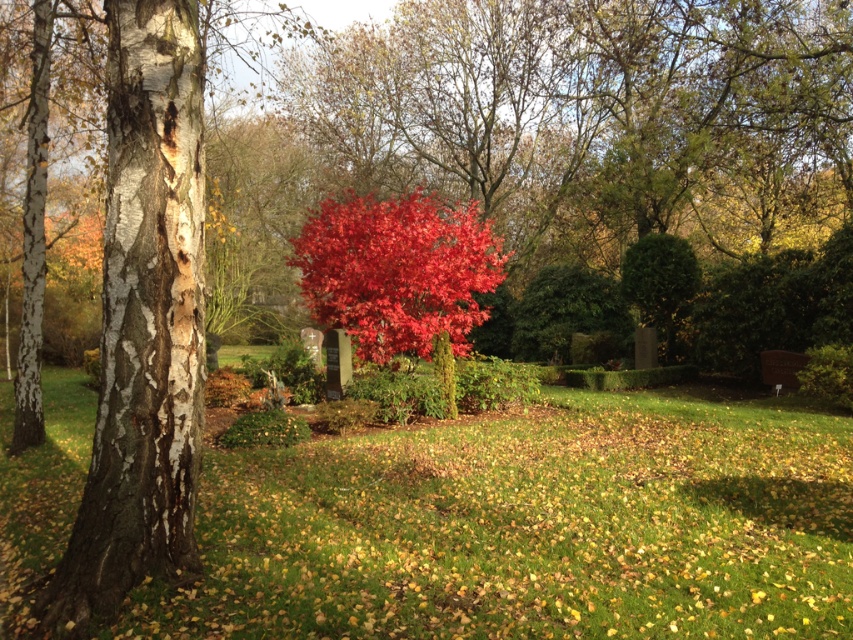
Between point (196, 468) and point (471, 296), which one is positioned in front?

Point (196, 468)

Between white bark birch tree at left and shiny red maple at center, which one appears on the right side from the viewer's perspective?

Positioned to the right is shiny red maple at center.

Is point (164, 273) farther from viewer compared to point (415, 214)?

No, it is not.

This screenshot has width=853, height=640. What are the coordinates of `white bark birch tree at left` in the screenshot? It's located at pyautogui.click(x=143, y=321).

Between point (44, 534) and point (108, 49), which one is positioned behind?

Positioned behind is point (44, 534).

Locate an element on the screen. Image resolution: width=853 pixels, height=640 pixels. green grass at center is located at coordinates (527, 528).

This screenshot has height=640, width=853. Find the location of `green grass at center`. green grass at center is located at coordinates (527, 528).

Based on the photo, can you confirm if green grass at center is smaller than shiny red maple at center?

Yes, green grass at center is smaller than shiny red maple at center.

Between green grass at center and shiny red maple at center, which one appears on the right side from the viewer's perspective?

From the viewer's perspective, green grass at center appears more on the right side.

Is point (767, 493) behind point (444, 246)?

That is False.

What are the coordinates of `green grass at center` in the screenshot? It's located at (527, 528).